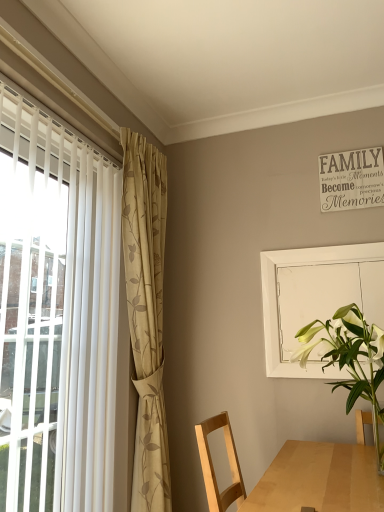
Question: Considering the relative sizes of white glossy vase at lower right and white matte screen door at upper right in the image provided, is white glossy vase at lower right taller than white matte screen door at upper right?

Choices:
 (A) no
 (B) yes

Answer: (A)

Question: Is white glossy vase at lower right positioned with its back to white matte screen door at upper right?

Choices:
 (A) yes
 (B) no

Answer: (A)

Question: From a real-world perspective, is white glossy vase at lower right under white matte screen door at upper right?

Choices:
 (A) no
 (B) yes

Answer: (B)

Question: From the image's perspective, is white glossy vase at lower right below white matte screen door at upper right?

Choices:
 (A) no
 (B) yes

Answer: (B)

Question: From a real-world perspective, does white glossy vase at lower right stand above white matte screen door at upper right?

Choices:
 (A) yes
 (B) no

Answer: (B)

Question: Is white glossy vase at lower right smaller than white matte screen door at upper right?

Choices:
 (A) no
 (B) yes

Answer: (A)

Question: Are white matte screen door at upper right and white glossy vase at lower right beside each other?

Choices:
 (A) no
 (B) yes

Answer: (A)

Question: Considering the relative sizes of white matte screen door at upper right and white glossy vase at lower right in the image provided, is white matte screen door at upper right wider than white glossy vase at lower right?

Choices:
 (A) no
 (B) yes

Answer: (A)

Question: Are white matte screen door at upper right and white glossy vase at lower right located far from each other?

Choices:
 (A) no
 (B) yes

Answer: (A)

Question: Does white matte screen door at upper right appear on the left side of white glossy vase at lower right?

Choices:
 (A) yes
 (B) no

Answer: (B)

Question: Could you tell me if white matte screen door at upper right is facing white glossy vase at lower right?

Choices:
 (A) yes
 (B) no

Answer: (A)

Question: Considering the relative sizes of white matte screen door at upper right and white glossy vase at lower right in the image provided, is white matte screen door at upper right smaller than white glossy vase at lower right?

Choices:
 (A) yes
 (B) no

Answer: (A)

Question: From the image's perspective, is white glossy vase at lower right beneath beige floral fabric curtain at left?

Choices:
 (A) yes
 (B) no

Answer: (A)